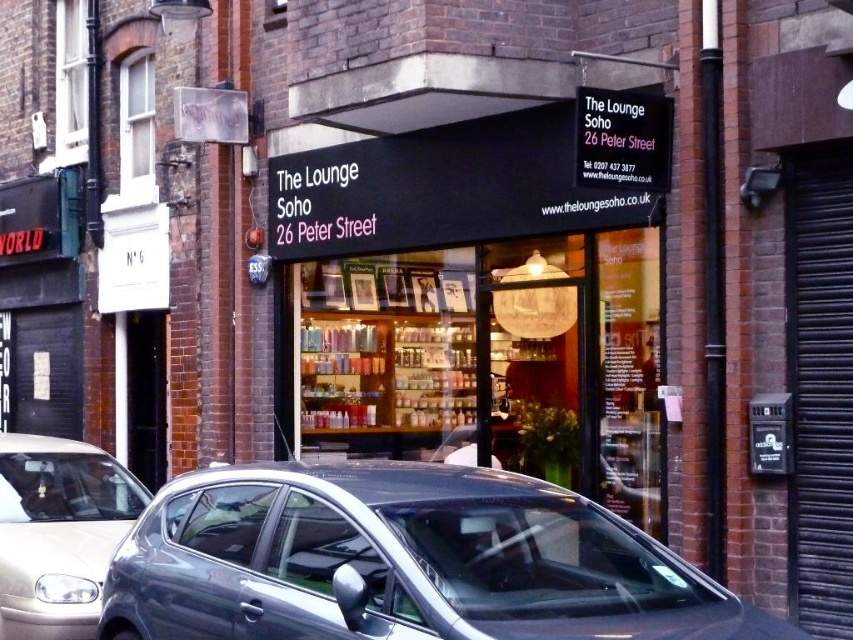
Image resolution: width=853 pixels, height=640 pixels. What do you see at coordinates (403, 561) in the screenshot?
I see `metallic gray hatchback at lower left` at bounding box center [403, 561].

Does metallic gray hatchback at lower left appear under silver metallic car at lower left?

Incorrect, metallic gray hatchback at lower left is not positioned below silver metallic car at lower left.

Locate an element on the screen. The width and height of the screenshot is (853, 640). metallic gray hatchback at lower left is located at coordinates (403, 561).

Image resolution: width=853 pixels, height=640 pixels. I want to click on metallic gray hatchback at lower left, so click(x=403, y=561).